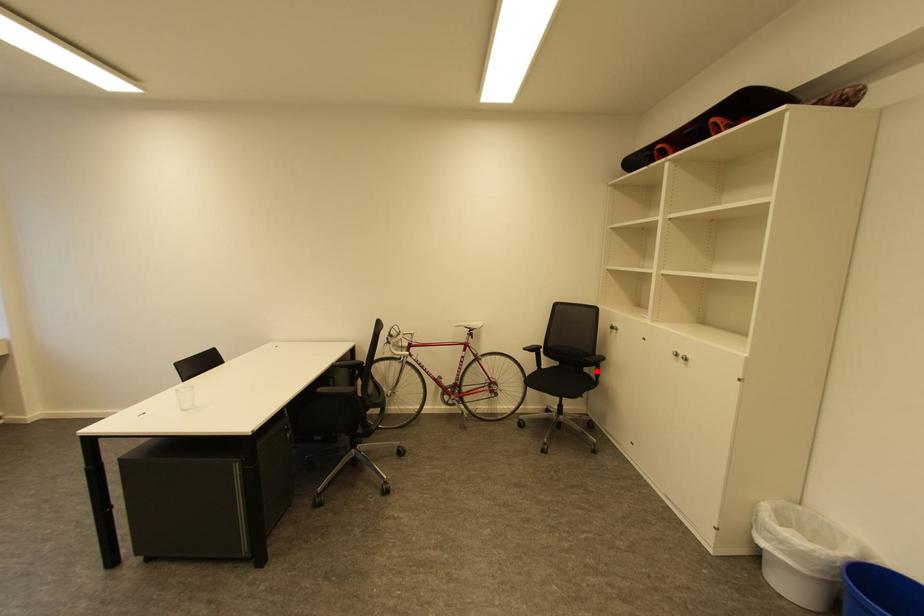
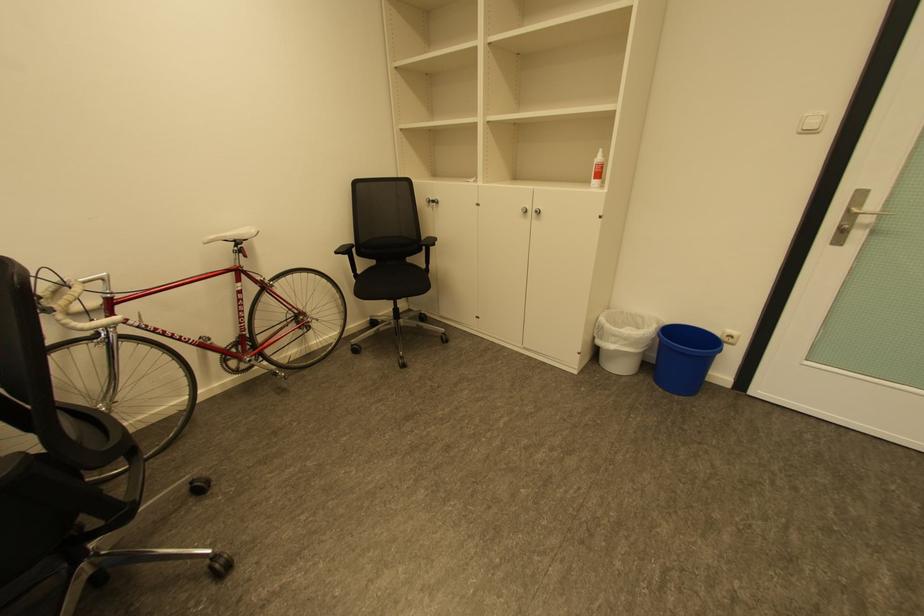
The point at the highlighted location is marked in the first image. Where is the corresponding point in the second image?

(426, 259)